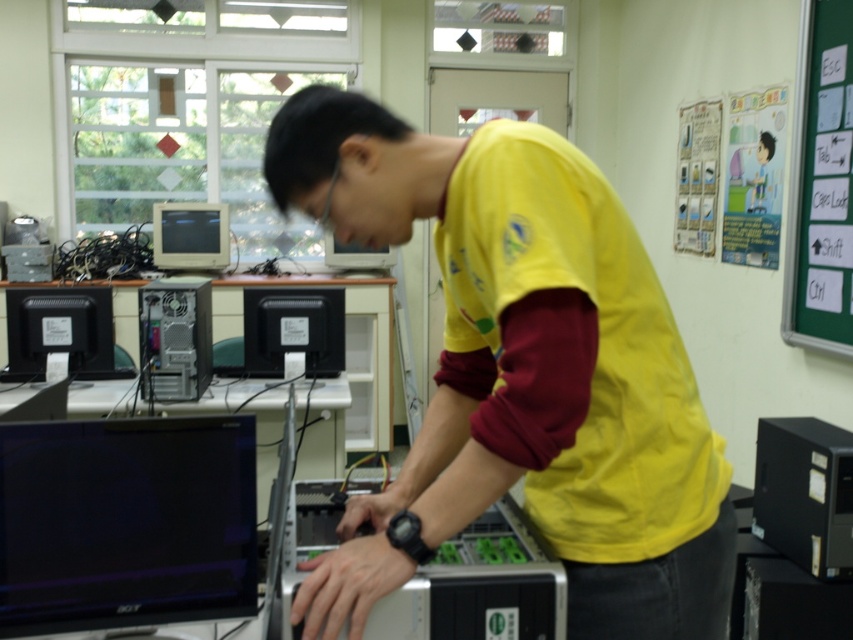
Question: Which point is closer to the camera?

Choices:
 (A) satin black case at center
 (B) black glossy monitor at lower left
 (C) matte black monitor at center
 (D) matte black monitor at left

Answer: (B)

Question: From the image, what is the correct spatial relationship of black glossy monitor at lower left in relation to black glossy monitor at left?

Choices:
 (A) below
 (B) above

Answer: (A)

Question: Does satin black case at center appear over black plastic monitor at center?

Choices:
 (A) yes
 (B) no

Answer: (B)

Question: Which object appears farthest from the camera in this image?

Choices:
 (A) black glossy monitor at left
 (B) black glossy monitor at lower left

Answer: (A)

Question: Is black glossy monitor at left smaller than satin black case at center?

Choices:
 (A) yes
 (B) no

Answer: (B)

Question: Which is nearer to the matte black monitor at left?

Choices:
 (A) green chalkboard at right
 (B) matte black monitor at center

Answer: (B)